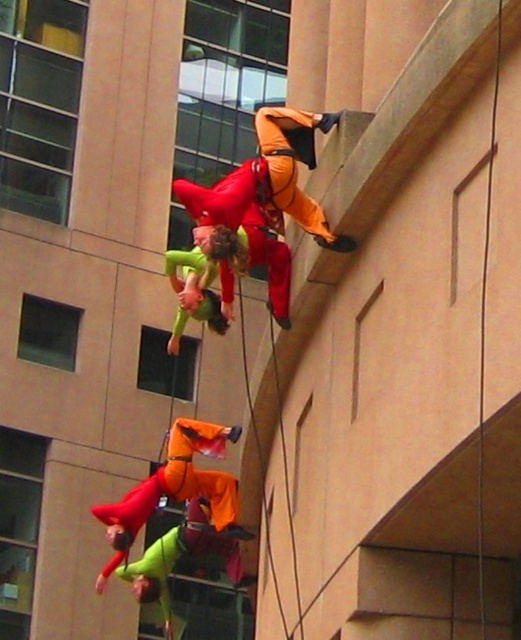
Can you confirm if orange fabric acrobat at center is positioned below green matte/synthetic suit at center?

Actually, orange fabric acrobat at center is above green matte/synthetic suit at center.

Locate an element on the screen. The height and width of the screenshot is (640, 521). orange fabric acrobat at center is located at coordinates (263, 204).

Locate an element on the screen. orange fabric acrobat at center is located at coordinates (263, 204).

Between neon green fabric at lower center and green matte/synthetic suit at center, which one appears on the left side from the viewer's perspective?

From the viewer's perspective, neon green fabric at lower center appears more on the left side.

Who is more distant from viewer, (221, 561) or (222, 316)?

The point (221, 561) is more distant.

Between point (166, 584) and point (188, 289), which one is positioned in front?

Positioned in front is point (188, 289).

Locate an element on the screen. The height and width of the screenshot is (640, 521). neon green fabric at lower center is located at coordinates (184, 563).

The width and height of the screenshot is (521, 640). What do you see at coordinates (176, 490) in the screenshot?
I see `orange fabric person at center` at bounding box center [176, 490].

Is orange fabric person at center above neon green fabric at lower center?

Indeed, orange fabric person at center is positioned over neon green fabric at lower center.

Is point (237, 504) farther from camera compared to point (180, 532)?

No, (237, 504) is closer to viewer.

You are a GUI agent. You are given a task and a screenshot of the screen. Output one action in this format:
    pyautogui.click(x=<x>, y=<y>)
    Task: Click on the orange fabric person at center
    
    Given the screenshot: What is the action you would take?
    pyautogui.click(x=176, y=490)